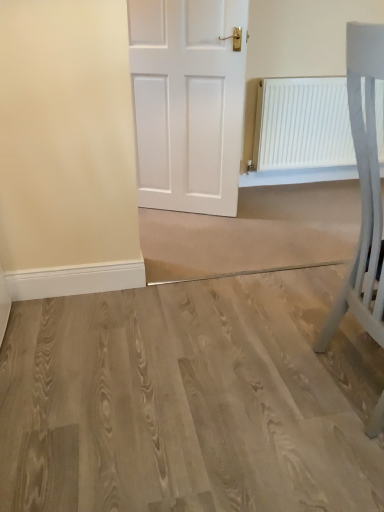
Locate an element on the screen. This screenshot has width=384, height=512. vacant area situated below white matte radiator at upper right (from a real-world perspective) is located at coordinates (281, 185).